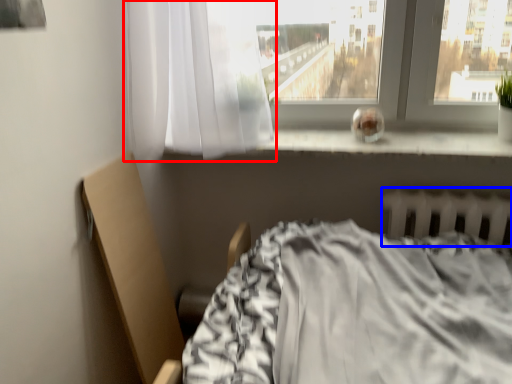
Question: Which of the following is the closest to the observer, curtain (highlighted by a red box) or radiator (highlighted by a blue box)?

Choices:
 (A) curtain
 (B) radiator

Answer: (A)